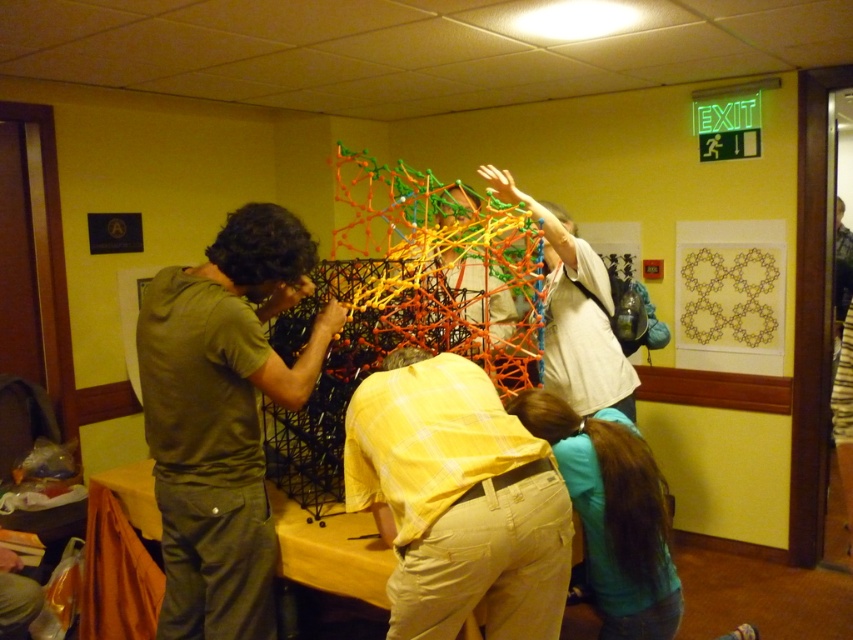
You are a photographer trying to capture a candid shot of the matte green shirt at left and the khaki pants at center. If you want to ensure both subjects are in focus, which one should you adjust your camera focus to prioritize based on their positions?

The matte green shirt at left might be wider than khaki pants at center, so you should prioritize focusing on the matte green shirt at left to ensure both are in focus.

You are a photographer standing in the room and want to take a photo of the light beige fabric shirt at center and the yellow matte table at center. Which object is closer to you?

The light beige fabric shirt at center is closer to you than the yellow matte table at center.

From the picture: You are a photographer in the room and want to capture a photo of the construction scene. You notice the matte green shirt at left and the khaki pants at center. Which clothing item is positioned higher in the image?

The matte green shirt at left is much taller than khaki pants at center, so the matte green shirt at left is positioned higher in the image.